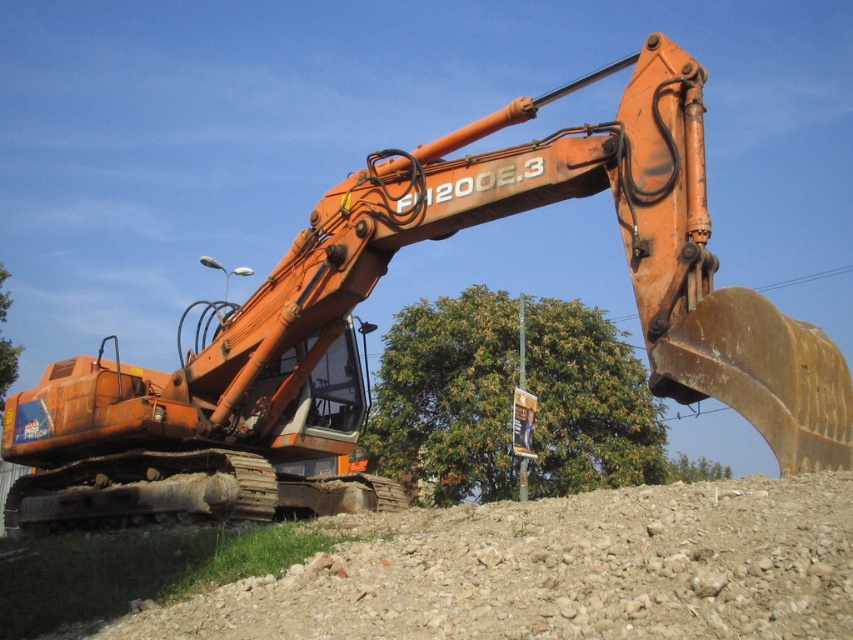
From the picture: Who is taller, brown gravel at lower center or green leafy tree at lower right?

Standing taller between the two is green leafy tree at lower right.

Is brown gravel at lower center closer to the viewer compared to green leafy tree at lower right?

Yes, brown gravel at lower center is in front of green leafy tree at lower right.

This screenshot has height=640, width=853. What are the coordinates of `brown gravel at lower center` in the screenshot? It's located at (554, 570).

Between brown gravel at lower center and green leafy tree at center, which one has more height?

Standing taller between the two is green leafy tree at center.

Can you confirm if brown gravel at lower center is shorter than green leafy tree at center?

Yes, brown gravel at lower center is shorter than green leafy tree at center.

Is point (569, 524) positioned in front of point (572, 477)?

Yes, it is.

Find the location of a particular element. The image size is (853, 640). brown gravel at lower center is located at coordinates (554, 570).

From the picture: Is green leafy tree at center to the left of green leafy tree at lower right from the viewer's perspective?

Indeed, green leafy tree at center is positioned on the left side of green leafy tree at lower right.

Can you confirm if green leafy tree at center is positioned below green leafy tree at lower right?

Incorrect, green leafy tree at center is not positioned below green leafy tree at lower right.

Identify the location of green leafy tree at center. (448, 397).